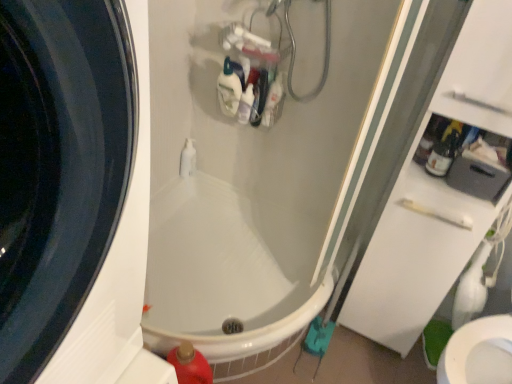
Question: Looking at their shapes, would you say red plastic bottle at lower left, the 3th cleaning product in the back-to-front sequence, is wider or thinner than white glossy bathtub at center?

Choices:
 (A) thin
 (B) wide

Answer: (A)

Question: Does point (178, 357) appear closer or farther from the camera than point (150, 289)?

Choices:
 (A) farther
 (B) closer

Answer: (B)

Question: Which object is the closest to the translucent plastic bottle at upper right?

Choices:
 (A) translucent plastic bottle at upper center, which appears as the 1th cleaning product when viewed from the top
 (B) white glossy pump bottle at center
 (C) white glossy bottle at upper center, the 2th cleaning product in the bottom-to-top sequence
 (D) red plastic bottle at lower left, the 1th cleaning product from the bottom
 (E) white glossy bathtub at center

Answer: (C)

Question: Which object is the closest to the red plastic bottle at lower left, the 1th cleaning product from the bottom?

Choices:
 (A) white glossy bathtub at center
 (B) translucent plastic bottle at upper right
 (C) translucent plastic bottle at upper center, which is the 3th cleaning product in front-to-back order
 (D) white glossy pump bottle at center
 (E) white glossy bottle at upper center, the 2th cleaning product in the bottom-to-top sequence

Answer: (A)